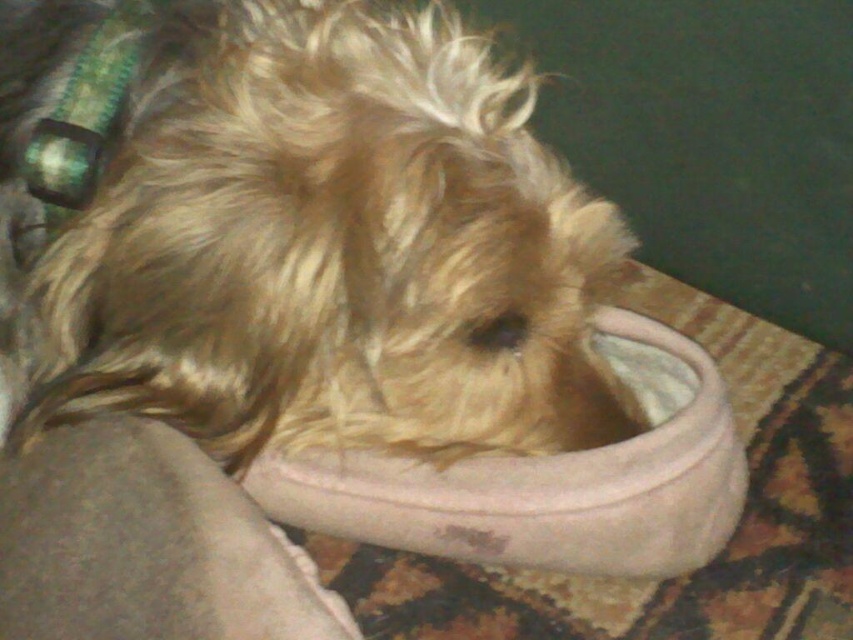
You are trying to find the beige suede slipper at center in a dimly lit room. Based on the scene description, where would you look relative to the fuzzy brown dog at center?

The fuzzy brown dog at center is positioned on the left side of the beige suede slipper at center, so the slipper is to the right of the dog.